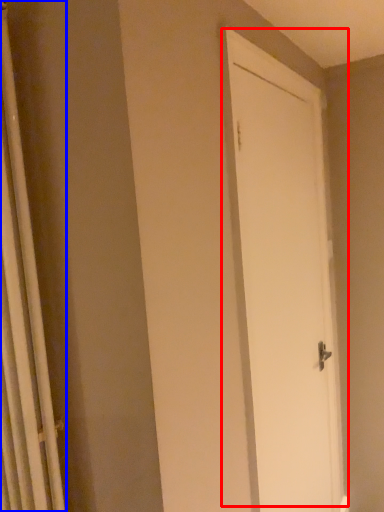
Question: Among these objects, which one is nearest to the camera, door (highlighted by a red box) or shower curtain (highlighted by a blue box)?

Choices:
 (A) door
 (B) shower curtain

Answer: (B)